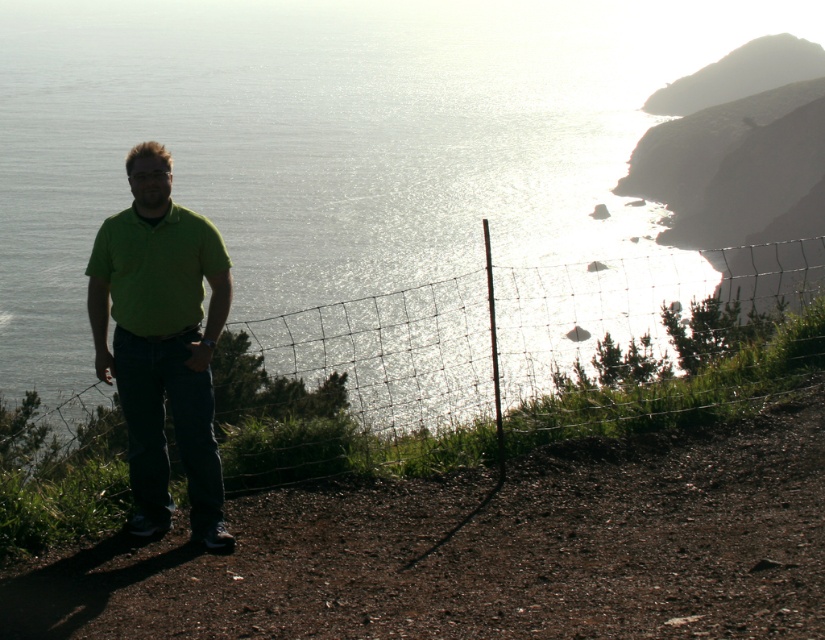
From the picture: You are a photographer planning to capture a landscape photo of the coastal view. You notice the green grass at lower left and the green matte shirt at center. Which object is closer to the camera based on their height?

The green grass at lower left is shorter than the green matte shirt at center, so the green matte shirt at center is closer to the camera.

You are a photographer trying to capture a photo of the green grass at lower left and the green matte shirt at center. Which object should you focus on first if you want both to be in sharp focus?

The green grass at lower left is in front of the green matte shirt at center, so you should focus on the green grass at lower left first to ensure both are in sharp focus.

You are a photographer planning to capture a landscape photo of the glistening silver water at center and the green matte shirt at center. The camera you are using has a maximum focus range of 100 meters. Will you be able to focus on both objects simultaneously?

The distance between the glistening silver water at center and the green matte shirt at center is 132.57 meters. Since the camera can only focus up to 100 meters, it won t be able to capture both objects in focus at the same time.